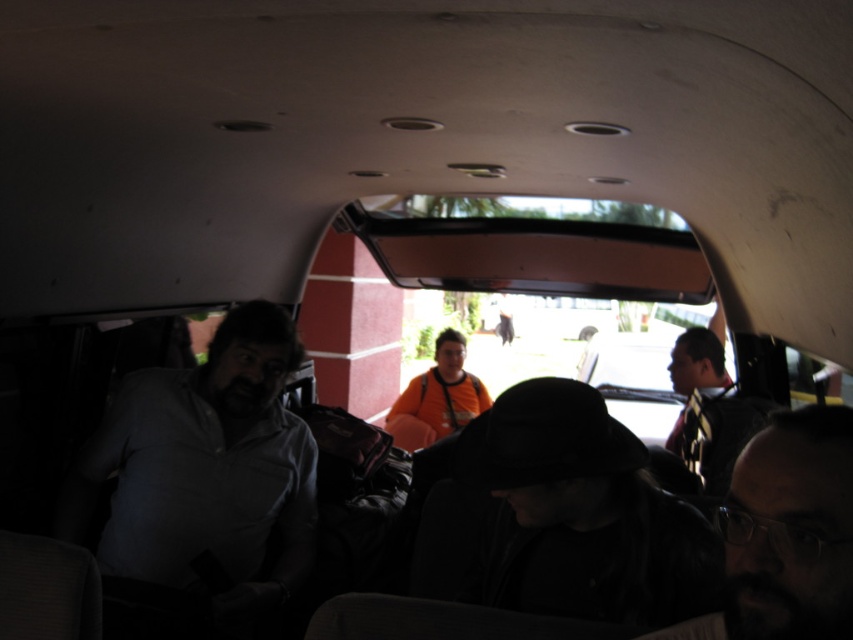
Who is positioned more to the left, matte gray shirt at left or dark hair at lower right?

Positioned to the left is matte gray shirt at left.

Can you confirm if matte gray shirt at left is bigger than dark hair at lower right?

Yes.

I want to click on matte gray shirt at left, so click(206, 470).

I want to click on matte gray shirt at left, so click(x=206, y=470).